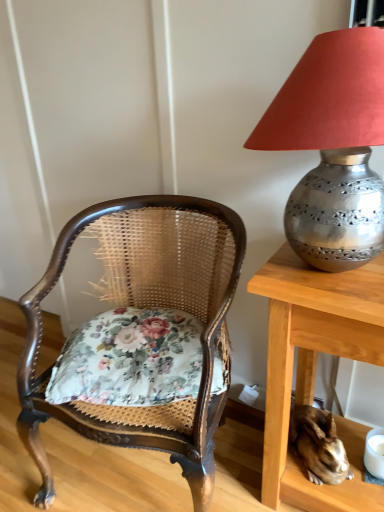
Question: Considering the relative positions of metallic silver lampshade at upper right and shiny metallic rabbit at lower right in the image provided, is metallic silver lampshade at upper right to the left of shiny metallic rabbit at lower right from the viewer's perspective?

Choices:
 (A) no
 (B) yes

Answer: (B)

Question: Is the position of metallic silver lampshade at upper right more distant than that of shiny metallic rabbit at lower right?

Choices:
 (A) no
 (B) yes

Answer: (A)

Question: Does metallic silver lampshade at upper right have a smaller size compared to shiny metallic rabbit at lower right?

Choices:
 (A) no
 (B) yes

Answer: (A)

Question: From a real-world perspective, is metallic silver lampshade at upper right on shiny metallic rabbit at lower right?

Choices:
 (A) no
 (B) yes

Answer: (B)

Question: Can you confirm if metallic silver lampshade at upper right is taller than shiny metallic rabbit at lower right?

Choices:
 (A) yes
 (B) no

Answer: (A)

Question: From the image's perspective, is shiny metallic rabbit at lower right positioned above or below floral fabric cushion at center?

Choices:
 (A) above
 (B) below

Answer: (B)

Question: From a real-world perspective, is shiny metallic rabbit at lower right above or below floral fabric cushion at center?

Choices:
 (A) above
 (B) below

Answer: (B)

Question: Visually, is shiny metallic rabbit at lower right positioned to the left or to the right of floral fabric cushion at center?

Choices:
 (A) right
 (B) left

Answer: (A)

Question: Considering the positions of shiny metallic rabbit at lower right and floral fabric cushion at center in the image, is shiny metallic rabbit at lower right wider or thinner than floral fabric cushion at center?

Choices:
 (A) wide
 (B) thin

Answer: (B)

Question: Relative to wooden cane chair with floral cushion at left, is shiny metallic rabbit at lower right in front or behind?

Choices:
 (A) behind
 (B) front

Answer: (A)

Question: From a real-world perspective, is shiny metallic rabbit at lower right above or below wooden cane chair with floral cushion at left?

Choices:
 (A) above
 (B) below

Answer: (B)

Question: Is shiny metallic rabbit at lower right wider or thinner than wooden cane chair with floral cushion at left?

Choices:
 (A) thin
 (B) wide

Answer: (A)

Question: Is shiny metallic rabbit at lower right spatially inside wooden cane chair with floral cushion at left, or outside of it?

Choices:
 (A) inside
 (B) outside

Answer: (B)

Question: Is floral fabric cushion at center in front of or behind metallic silver lampshade at upper right in the image?

Choices:
 (A) behind
 (B) front

Answer: (A)

Question: From the image's perspective, is floral fabric cushion at center located above or below metallic silver lampshade at upper right?

Choices:
 (A) below
 (B) above

Answer: (A)